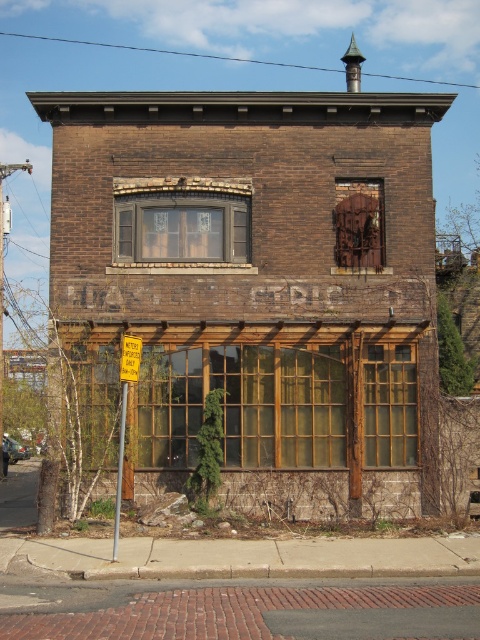
Question: Which object appears farthest from the camera in this image?

Choices:
 (A) brown textured window at center
 (B) yellow plastic sign at center

Answer: (A)

Question: Which of the following is the closest to the observer?

Choices:
 (A) (414, 460)
 (B) (225, 180)
 (C) (121, 460)
 (D) (369, 244)

Answer: (C)

Question: Can you confirm if rusty metal window at center is positioned above yellow plastic sign at lower left?

Choices:
 (A) yes
 (B) no

Answer: (A)

Question: Does brown textured window at center appear on the left side of rusty metal window at center?

Choices:
 (A) yes
 (B) no

Answer: (A)

Question: Which point appears closest to the camera in this image?

Choices:
 (A) (176, 188)
 (B) (122, 365)
 (C) (415, 385)
 (D) (123, 358)

Answer: (B)

Question: Can you confirm if brown textured window at center is smaller than yellow plastic sign at lower left?

Choices:
 (A) no
 (B) yes

Answer: (A)